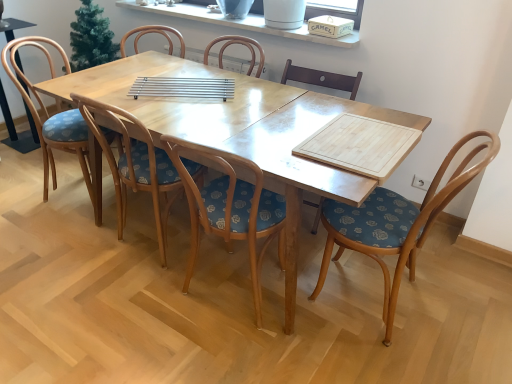
At what (x,y) coordinates should I click in order to perform the action: click on free spot in front of wooden chair with floral cushion at center, the first chair from the left. Please return your answer as a coordinate pair (x, y). The height and width of the screenshot is (384, 512). Looking at the image, I should click on (56, 235).